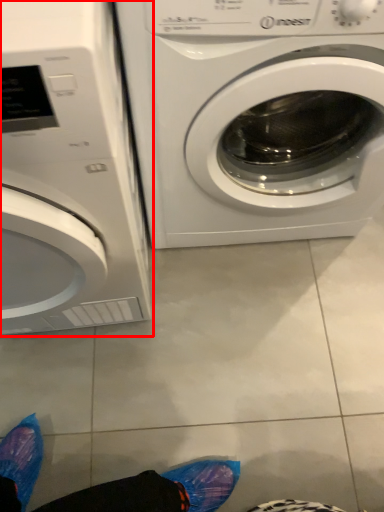
Question: From the image's perspective, what is the correct spatial relationship of washing machine (annotated by the red box) in relation to washing machine?

Choices:
 (A) above
 (B) below

Answer: (B)